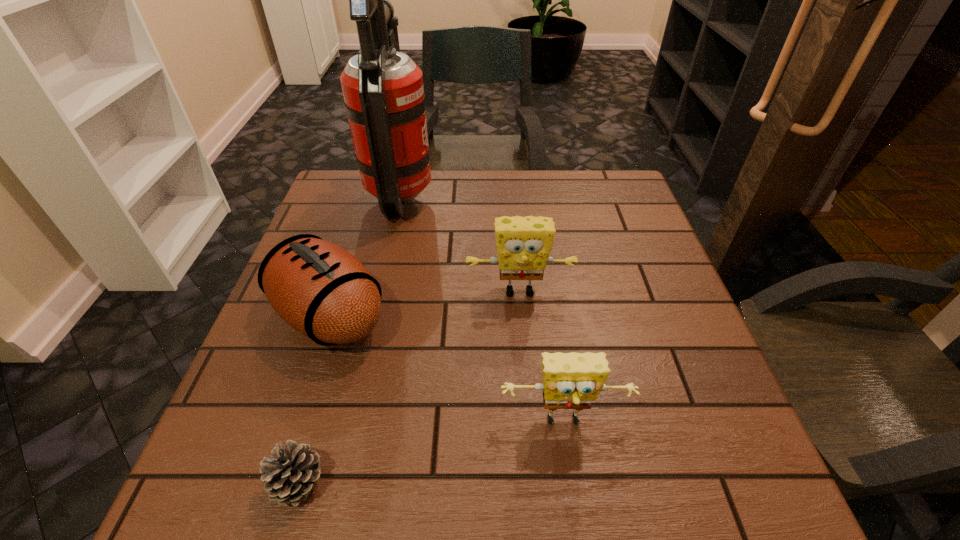
In order to click on the tallest object in this screenshot , I will do `click(383, 90)`.

At what (x,y) coordinates should I click in order to perform the action: click on the farthest object. Please return your answer as a coordinate pair (x, y). The image size is (960, 540). Looking at the image, I should click on (383, 90).

This screenshot has width=960, height=540. Identify the location of the farther sponge. (523, 244).

Locate an element on the screen. This screenshot has width=960, height=540. football (American) is located at coordinates (321, 290).

Where is `the shorter sponge`? This screenshot has height=540, width=960. the shorter sponge is located at coordinates (573, 380).

I want to click on the second nearest object, so click(573, 380).

Where is `pinecone`? pinecone is located at coordinates (291, 473).

Locate an element on the screen. The image size is (960, 540). the shortest object is located at coordinates (291, 473).

Find the location of `free spot located 0.270m on the front label side of the tallest object`. free spot located 0.270m on the front label side of the tallest object is located at coordinates (533, 197).

What are the coordinates of `free space located on the face of the farther sponge` in the screenshot? It's located at (528, 384).